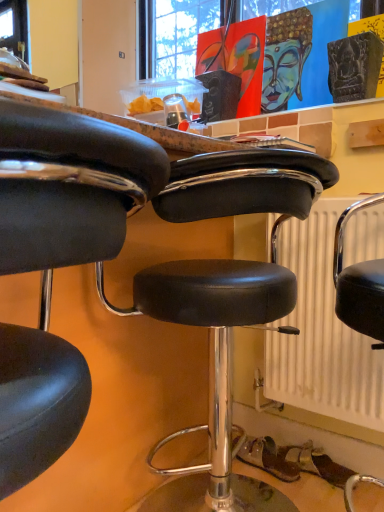
Question: From the image's perspective, is black leather stool at center, arranged as the second chair when viewed from the front, located above or below white textured radiator at center?

Choices:
 (A) below
 (B) above

Answer: (A)

Question: Is black leather stool at center, arranged as the second chair when viewed from the front, inside or outside of white textured radiator at center?

Choices:
 (A) inside
 (B) outside

Answer: (B)

Question: Which of these objects is positioned farthest from the white textured radiator at center?

Choices:
 (A) black leather stool at center, placed as the 2th chair when sorted from back to front
 (B) black leather stool at center, the 1th chair from the back

Answer: (A)

Question: Estimate the real-world distances between objects in this image. Which object is farther from the black leather stool at center, which ranks as the first chair in front-to-back order?

Choices:
 (A) white textured radiator at center
 (B) black leather stool at center, arranged as the second chair when viewed from the front

Answer: (A)